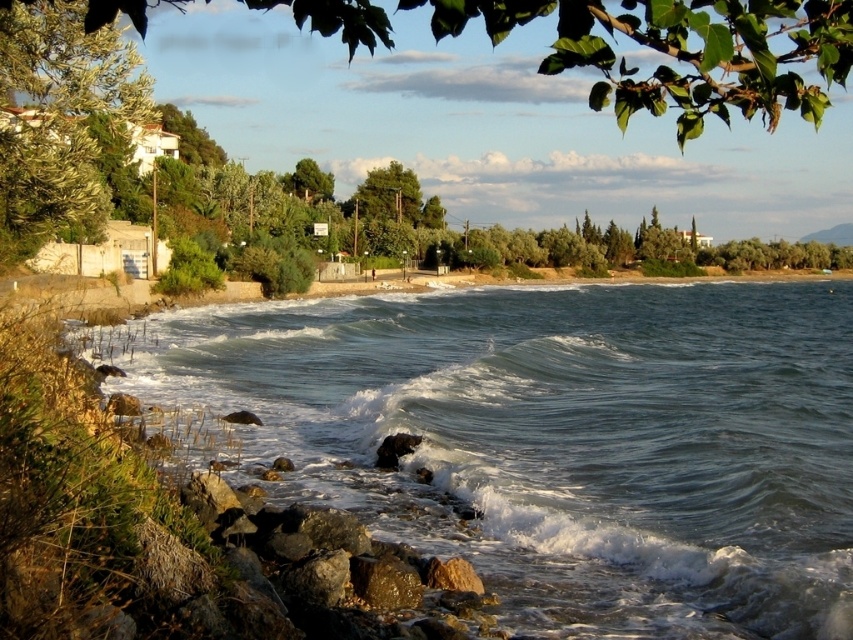
Based on the photo, you are standing on the rocky shore and want to reach the green leafy tree at upper center. Which direction should you move to get closer to it without crossing the clear blue water at center?

The green leafy tree at upper center is behind the clear blue water at center, so you should move towards the shore away from the water to reach it without crossing the water.

You are an artist planning to paint this coastal scene. You want to ensure the green leafy tree at upper center and the green leafy tree at upper left are proportionally accurate. Which tree should you make wider in your painting?

The green leafy tree at upper center should be made wider in the painting since its width surpasses that of the green leafy tree at upper left according to the description.